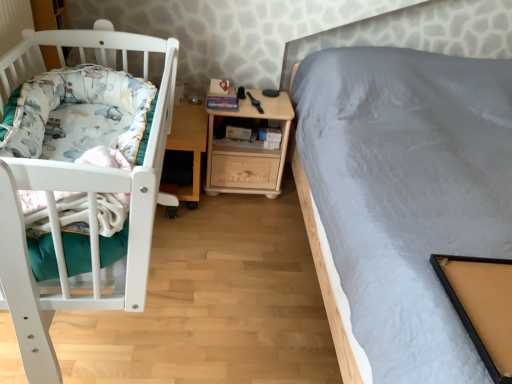
Question: From the image's perspective, is wooden nightstand at center on top of wooden table at center?

Choices:
 (A) yes
 (B) no

Answer: (A)

Question: Is wooden nightstand at center bigger than wooden table at center?

Choices:
 (A) no
 (B) yes

Answer: (B)

Question: Are wooden nightstand at center and wooden table at center far apart?

Choices:
 (A) yes
 (B) no

Answer: (B)

Question: Is wooden nightstand at center oriented towards wooden table at center?

Choices:
 (A) yes
 (B) no

Answer: (B)

Question: Can you confirm if wooden nightstand at center is positioned to the left of wooden table at center?

Choices:
 (A) yes
 (B) no

Answer: (B)

Question: Considering the relative sizes of wooden nightstand at center and wooden table at center in the image provided, is wooden nightstand at center taller than wooden table at center?

Choices:
 (A) yes
 (B) no

Answer: (A)

Question: Is white soft blanket at left closer to camera compared to wooden table at center?

Choices:
 (A) yes
 (B) no

Answer: (A)

Question: Is white soft blanket at left thinner than wooden table at center?

Choices:
 (A) yes
 (B) no

Answer: (A)

Question: Is the position of white soft blanket at left more distant than that of wooden table at center?

Choices:
 (A) no
 (B) yes

Answer: (A)

Question: Could you tell me if white soft blanket at left is turned towards wooden table at center?

Choices:
 (A) yes
 (B) no

Answer: (B)

Question: Is white soft blanket at left next to wooden table at center and touching it?

Choices:
 (A) yes
 (B) no

Answer: (B)

Question: Does white soft blanket at left have a greater width compared to wooden table at center?

Choices:
 (A) yes
 (B) no

Answer: (B)

Question: Considering the relative positions of white soft blanket at left and wooden nightstand at center in the image provided, is white soft blanket at left to the right of wooden nightstand at center from the viewer's perspective?

Choices:
 (A) no
 (B) yes

Answer: (A)